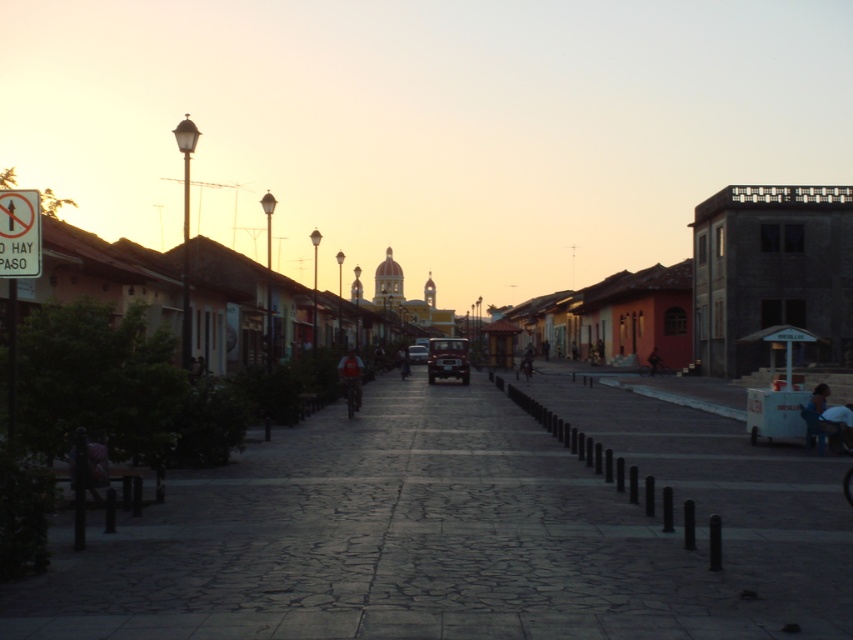
Can you confirm if red fabric shirt at center is positioned below dark blue jeans at center?

Correct, red fabric shirt at center is located below dark blue jeans at center.

Between red fabric shirt at center and dark blue jeans at center, which one is positioned lower?

red fabric shirt at center is below.

Between point (357, 355) and point (654, 360), which one is positioned behind?

The point (654, 360) is behind.

Find the location of `red fabric shirt at center`. red fabric shirt at center is located at coordinates (350, 380).

Does point (218, 620) come behind point (357, 372)?

No, it is in front of (357, 372).

Does point (769, 634) come in front of point (352, 353)?

Yes.

The image size is (853, 640). What do you see at coordinates (463, 531) in the screenshot?
I see `gray stone pavement at center` at bounding box center [463, 531].

You are a GUI agent. You are given a task and a screenshot of the screen. Output one action in this format:
    pyautogui.click(x=<x>, y=<y>)
    Task: Click on the gray stone pavement at center
    
    Given the screenshot: What is the action you would take?
    pyautogui.click(x=463, y=531)

Can you confirm if gray stone pavement at center is smaller than pink fabric person at lower left?

Actually, gray stone pavement at center might be larger than pink fabric person at lower left.

How distant is gray stone pavement at center from pink fabric person at lower left?

They are 17.89 feet apart.

Locate an element on the screen. This screenshot has width=853, height=640. gray stone pavement at center is located at coordinates (463, 531).

Identify the location of gray stone pavement at center. (463, 531).